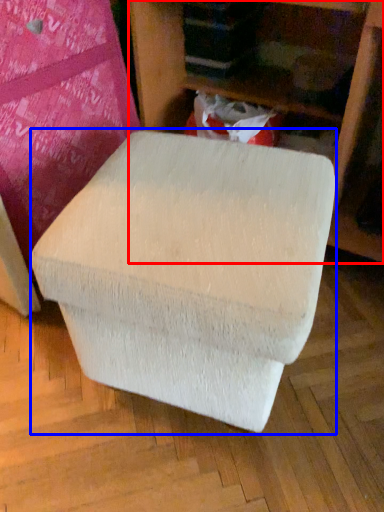
Question: Among these objects, which one is farthest to the camera, furniture (highlighted by a red box) or bean bag chair (highlighted by a blue box)?

Choices:
 (A) furniture
 (B) bean bag chair

Answer: (A)